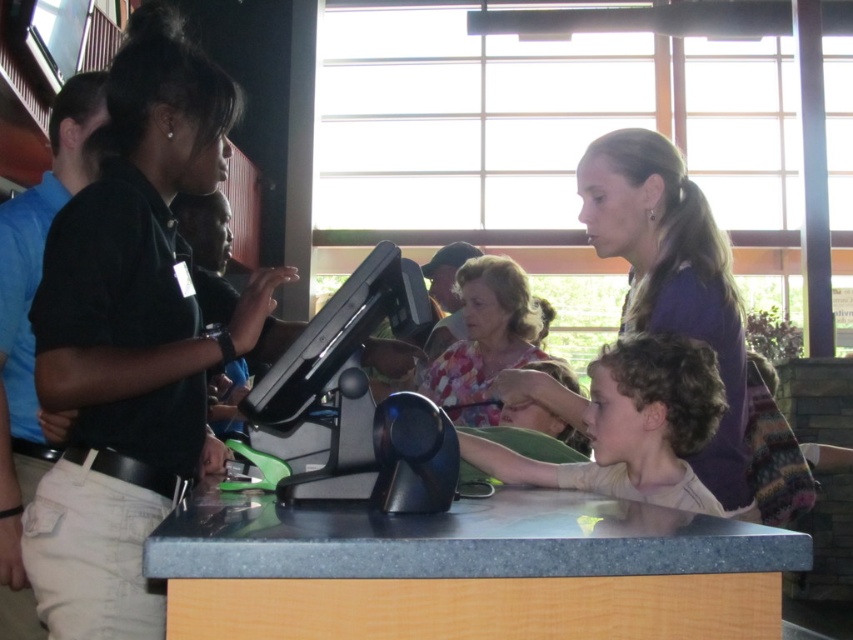
Which is above, purple matte shirt at upper right or floral fabric blouse at center?

purple matte shirt at upper right is above.

Is purple matte shirt at upper right positioned at the back of floral fabric blouse at center?

No, purple matte shirt at upper right is closer to the viewer.

Which is behind, point (630, 292) or point (538, 340)?

The point (538, 340) is more distant.

Find the location of a particular element. purple matte shirt at upper right is located at coordinates pos(671,275).

Between purple matte shirt at upper right and curly brown hair at center, which one has less height?

curly brown hair at center

The width and height of the screenshot is (853, 640). What do you see at coordinates (671, 275) in the screenshot?
I see `purple matte shirt at upper right` at bounding box center [671, 275].

Where is `purple matte shirt at upper right`? This screenshot has height=640, width=853. purple matte shirt at upper right is located at coordinates (671, 275).

Is granite countertop at center positioned at the back of floral fabric blouse at center?

No, it is in front of floral fabric blouse at center.

Who is shorter, granite countertop at center or floral fabric blouse at center?

With less height is granite countertop at center.

Is point (659, 531) closer to camera compared to point (465, 285)?

That is True.

Find the location of a particular element. granite countertop at center is located at coordinates (469, 570).